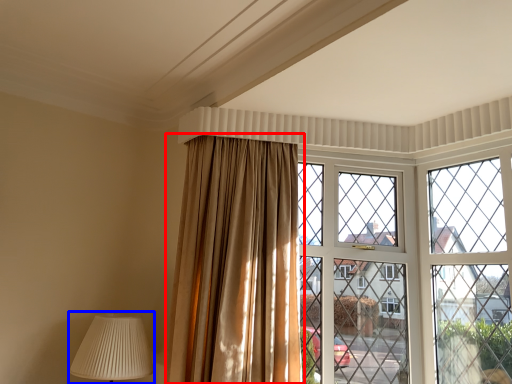
Question: Among these objects, which one is farthest to the camera, curtain (highlighted by a red box) or table lamp (highlighted by a blue box)?

Choices:
 (A) curtain
 (B) table lamp

Answer: (B)